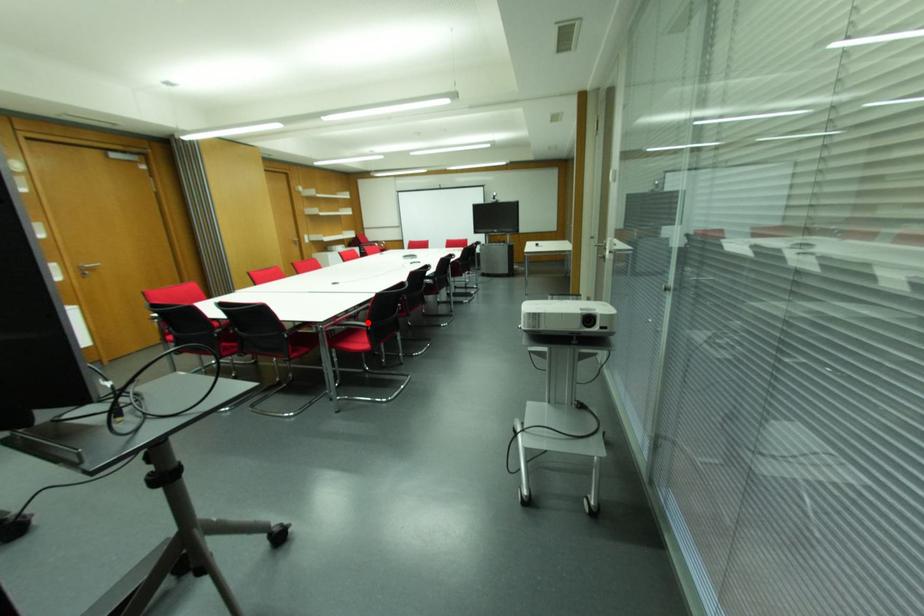
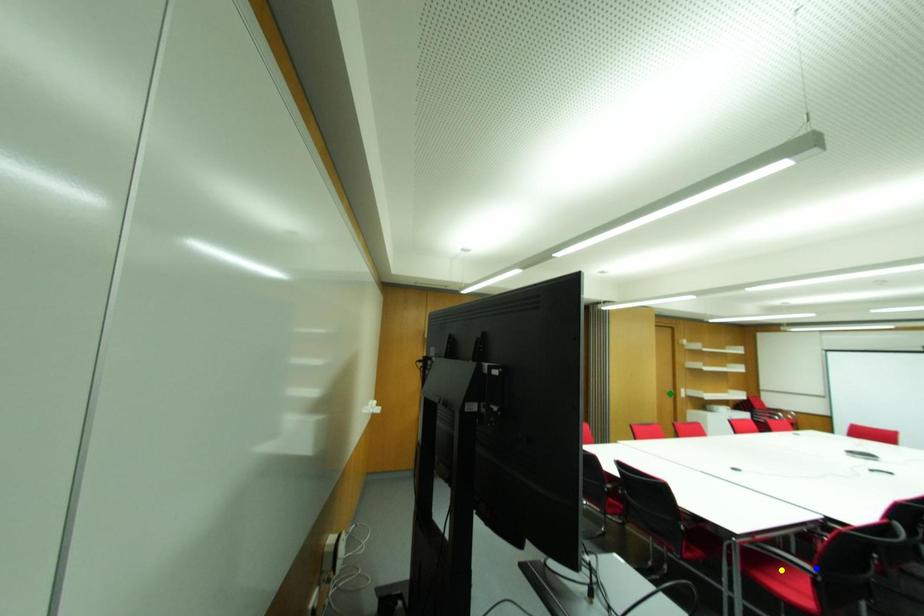
Question: I am providing you with two images of the same scene from different viewpoints. A red point is marked on the first image. You are given multiple points on the second image. Can you choose the point in image 2 that corresponds to the point in image 1?

Choices:
 (A) blue point
 (B) yellow point
 (C) green point

Answer: (A)